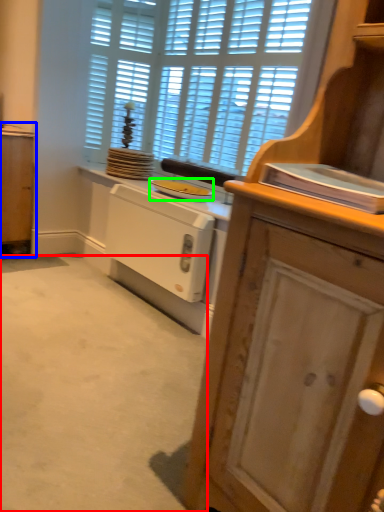
Question: Considering the real-world distances, which object is farthest from plain (highlighted by a red box)? cabinetry (highlighted by a blue box) or appliance (highlighted by a green box)?

Choices:
 (A) cabinetry
 (B) appliance

Answer: (A)